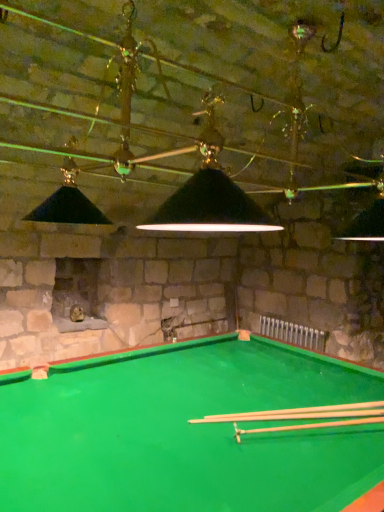
Question: Can smooth wood cue at center, which appears as the 2th cue when viewed from the front, be found inside wooden cue at center, arranged as the 1th cue when viewed from the front?

Choices:
 (A) no
 (B) yes

Answer: (A)

Question: Considering the relative sizes of wooden cue at center, arranged as the 1th cue when viewed from the front, and smooth wood cue at center, the 1th cue positioned from the back, in the image provided, is wooden cue at center, arranged as the 1th cue when viewed from the front, thinner than smooth wood cue at center, the 1th cue positioned from the back,?

Choices:
 (A) no
 (B) yes

Answer: (B)

Question: Is wooden cue at center, which is the 2th cue in back-to-front order, oriented away from smooth wood cue at center, the 1th cue positioned from the back?

Choices:
 (A) yes
 (B) no

Answer: (B)

Question: Can you confirm if wooden cue at center, arranged as the 1th cue when viewed from the front, is shorter than smooth wood cue at center, which appears as the 2th cue when viewed from the front?

Choices:
 (A) yes
 (B) no

Answer: (B)

Question: From a real-world perspective, is wooden cue at center, arranged as the 1th cue when viewed from the front, positioned over smooth wood cue at center, the 1th cue positioned from the back, based on gravity?

Choices:
 (A) no
 (B) yes

Answer: (B)

Question: Is wooden cue at center, arranged as the 1th cue when viewed from the front, positioned behind smooth wood cue at center, the 1th cue positioned from the back?

Choices:
 (A) no
 (B) yes

Answer: (A)

Question: Is smooth wood cue at center, which appears as the 2th cue when viewed from the front, to the left of wooden cue at center, which is the 2th cue in back-to-front order, from the viewer's perspective?

Choices:
 (A) yes
 (B) no

Answer: (A)

Question: Is smooth wood cue at center, the 1th cue positioned from the back, closer to camera compared to wooden cue at center, arranged as the 1th cue when viewed from the front?

Choices:
 (A) yes
 (B) no

Answer: (B)

Question: Does smooth wood cue at center, the 1th cue positioned from the back, turn towards wooden cue at center, which is the 2th cue in back-to-front order?

Choices:
 (A) no
 (B) yes

Answer: (A)

Question: Is smooth wood cue at center, the 1th cue positioned from the back, outside wooden cue at center, which is the 2th cue in back-to-front order?

Choices:
 (A) no
 (B) yes

Answer: (B)

Question: Is smooth wood cue at center, the 1th cue positioned from the back, thinner than wooden cue at center, arranged as the 1th cue when viewed from the front?

Choices:
 (A) no
 (B) yes

Answer: (A)

Question: From a real-world perspective, is smooth wood cue at center, which appears as the 2th cue when viewed from the front, located higher than wooden cue at center, which is the 2th cue in back-to-front order?

Choices:
 (A) no
 (B) yes

Answer: (A)

Question: From the image's perspective, is wooden cue at center, which is the 2th cue in back-to-front order, located above or below smooth wood cue at center, which appears as the 2th cue when viewed from the front?

Choices:
 (A) below
 (B) above

Answer: (B)